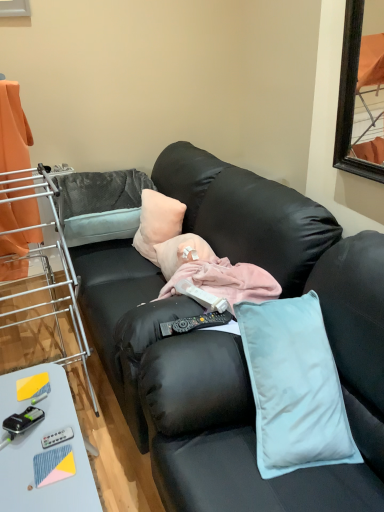
Locate an element on the screen. free space on the front side of black plastic remote control at lower left, which ranks as the second equipment in right-to-left order is located at coordinates [x=26, y=467].